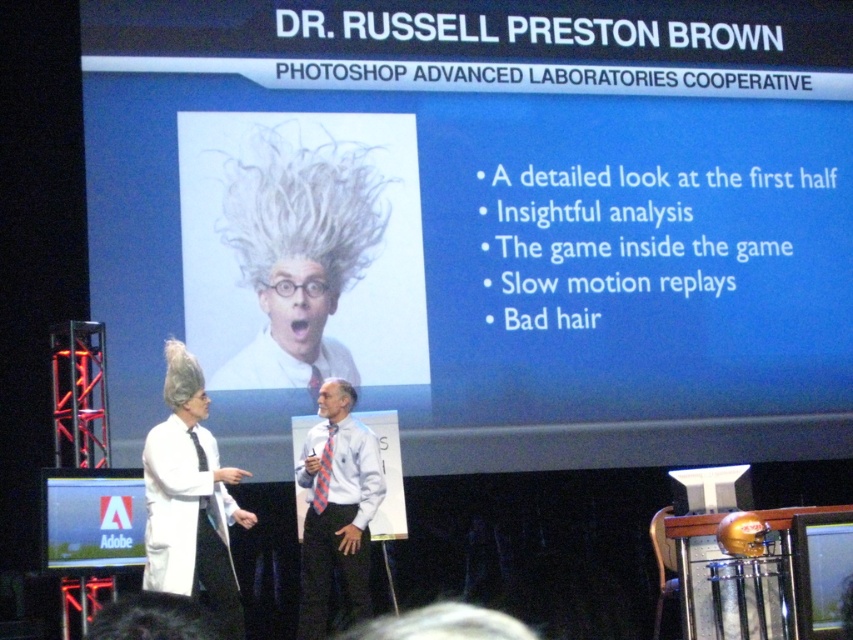
You are an event organizer setting up chairs for an audience. You need to ensure that the chairs are placed so that everyone can see both the blue matte projection screen at upper center and the white shirt at center. Given that the screen is wider than the shirt, which object should you prioritize placing chairs to face towards for optimal visibility of both?

The blue matte projection screen at upper center is wider than the white shirt at center, so you should prioritize placing chairs to face towards the screen. This ensures that the wider screen remains visible while the narrower white shirt at center will naturally be within the audience members viewing angle.

You are an event organizer setting up a presentation room. You have two screens available. The blue matte projection screen at upper center and the matte black screen at lower left. Which screen should you choose if you want the audience to see the presentation content clearly from a distance?

The blue matte projection screen at upper center has a larger size compared to the matte black screen at lower left, so it would be better to choose the blue matte projection screen at upper center for better visibility from a distance.